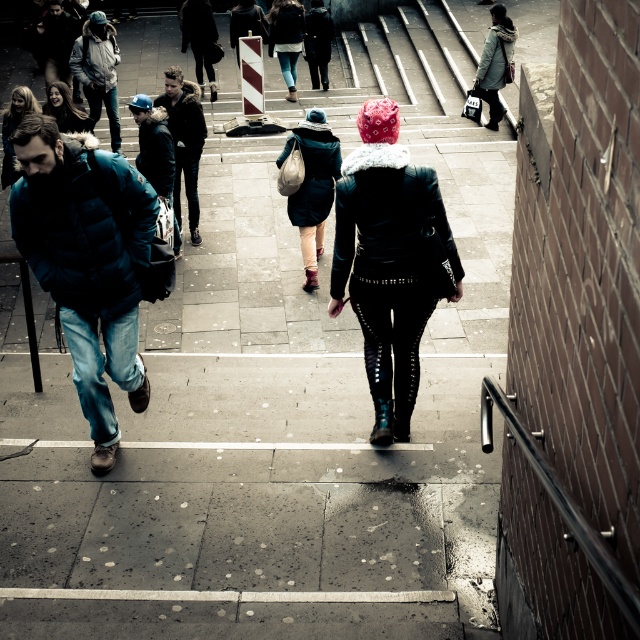
Looking at this image, you are a photographer trying to capture both the dark blue jacket at center and the matte black jacket at upper right in a single frame. Based on their positions, which jacket would appear larger in the photo?

The matte black jacket at upper right would appear larger in the photo because it is taller than the dark blue jacket at center.

You are standing on the sidewalk and see both the dark blue jacket at center and the matte black jacket at upper right. Which jacket is nearer to you?

The dark blue jacket at center is closer to the viewer than the matte black jacket at upper right.

From the picture: You are a photographer trying to capture a candid shot of both the matte black jacket at upper right and the dark brown hair at center in the same frame. Based on their positions and sizes, which subject should you focus on first to ensure both are in the frame?

The matte black jacket at upper right is taller than the dark brown hair at center, so you should focus on the matte black jacket at upper right first to ensure both are in the frame.